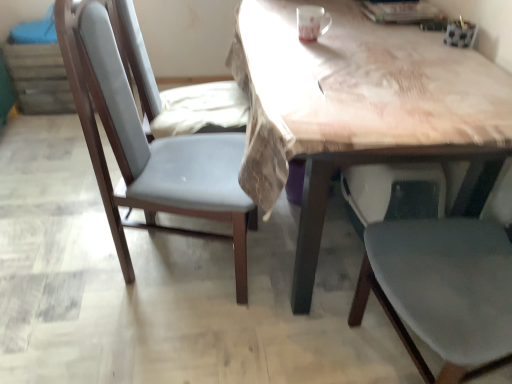
I want to click on free space in front of matte gray chair at center, so click(173, 341).